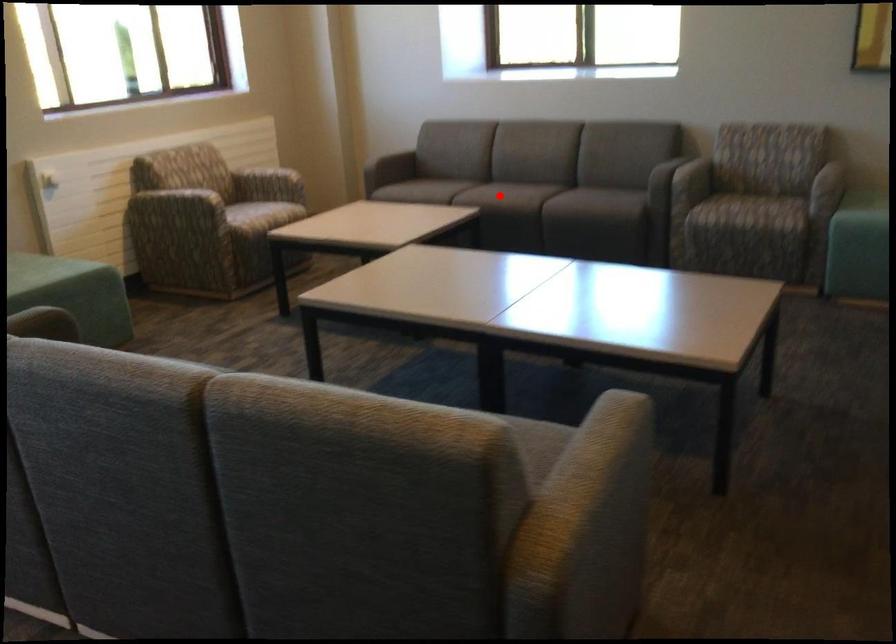
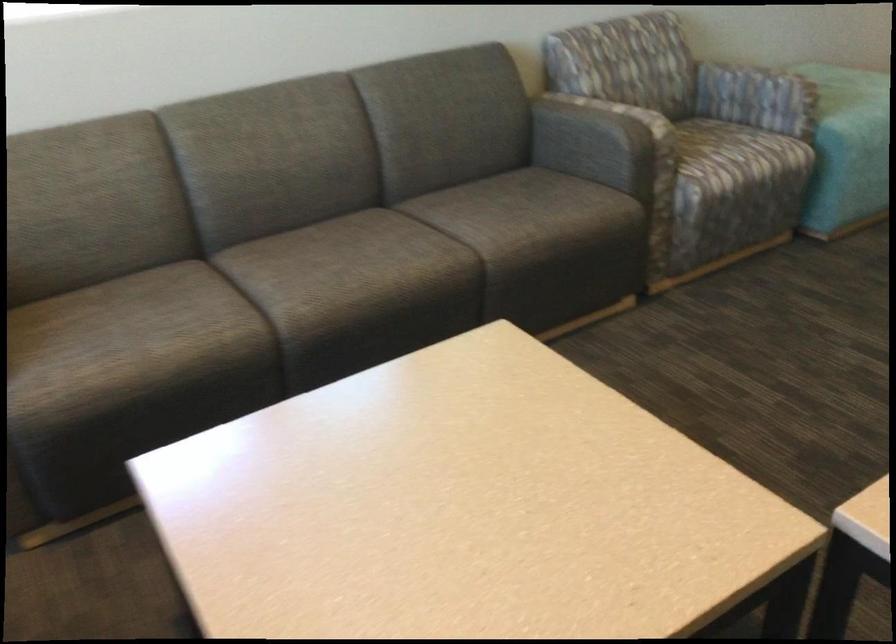
Question: I am providing you with two images of the same scene from different viewpoints. In image1, a red point is highlighted. Considering the same 3D point in image2, which of the following is correct?

Choices:
 (A) It is closer
 (B) It is farther

Answer: (A)